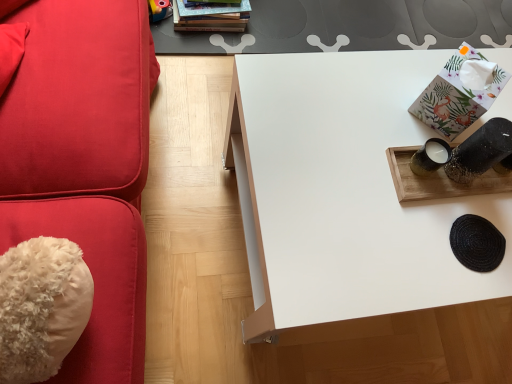
Question: Can you confirm if floral paper tissue at upper right is bigger than white matte table at center?

Choices:
 (A) yes
 (B) no

Answer: (B)

Question: Does floral paper tissue at upper right appear on the right side of white matte table at center?

Choices:
 (A) no
 (B) yes

Answer: (B)

Question: Is floral paper tissue at upper right not close to white matte table at center?

Choices:
 (A) no
 (B) yes

Answer: (A)

Question: From a real-world perspective, is floral paper tissue at upper right beneath white matte table at center?

Choices:
 (A) no
 (B) yes

Answer: (A)

Question: Considering the relative sizes of floral paper tissue at upper right and white matte table at center in the image provided, is floral paper tissue at upper right smaller than white matte table at center?

Choices:
 (A) no
 (B) yes

Answer: (B)

Question: Does point (455, 76) appear closer or farther from the camera than point (227, 21)?

Choices:
 (A) closer
 (B) farther

Answer: (A)

Question: Considering their positions, is floral paper tissue at upper right located in front of or behind hardcover books at upper center?

Choices:
 (A) behind
 (B) front

Answer: (B)

Question: Looking at the image, does floral paper tissue at upper right seem bigger or smaller compared to hardcover books at upper center?

Choices:
 (A) big
 (B) small

Answer: (B)

Question: Is floral paper tissue at upper right inside the boundaries of hardcover books at upper center, or outside?

Choices:
 (A) outside
 (B) inside

Answer: (A)

Question: In terms of height, does white matte table at center look taller or shorter compared to hardcover books at upper center?

Choices:
 (A) short
 (B) tall

Answer: (B)

Question: Based on their positions, is white matte table at center located to the left or right of hardcover books at upper center?

Choices:
 (A) left
 (B) right

Answer: (B)

Question: Is point (312, 94) positioned closer to the camera than point (226, 19)?

Choices:
 (A) closer
 (B) farther

Answer: (A)

Question: Is white matte table at center situated inside hardcover books at upper center or outside?

Choices:
 (A) inside
 (B) outside

Answer: (B)

Question: Is white matte table at center inside or outside of floral paper tissue at upper right?

Choices:
 (A) outside
 (B) inside

Answer: (A)

Question: Is point click(x=269, y=251) positioned closer to the camera than point click(x=445, y=132)?

Choices:
 (A) closer
 (B) farther

Answer: (A)